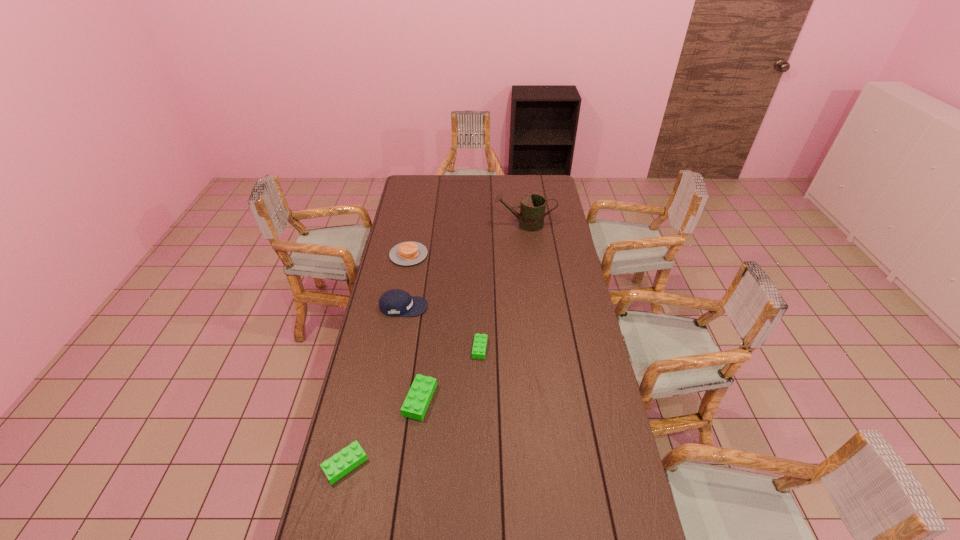
At what (x,y) coordinates should I click in order to perform the action: click on the nearest Lego. Please return your answer as a coordinate pair (x, y). Looking at the image, I should click on (341, 463).

This screenshot has height=540, width=960. Find the location of `the leftmost Lego`. the leftmost Lego is located at coordinates [x=341, y=463].

The height and width of the screenshot is (540, 960). Identify the location of the tallest Lego. (422, 389).

Image resolution: width=960 pixels, height=540 pixels. Identify the location of the second Lego from right to left. (422, 389).

Locate an element on the screen. Image resolution: width=960 pixels, height=540 pixels. the fourth farthest object is located at coordinates (480, 340).

Locate an element on the screen. The image size is (960, 540). the rightmost Lego is located at coordinates (480, 340).

I want to click on the tallest object, so click(532, 206).

Where is `the farthest object`? the farthest object is located at coordinates (532, 206).

You are a GUI agent. You are given a task and a screenshot of the screen. Output one action in this format:
    pyautogui.click(x=<x>, y=<y>)
    Task: Click on the second farthest object
    The width and height of the screenshot is (960, 540).
    Given the screenshot: What is the action you would take?
    pyautogui.click(x=406, y=253)

What are the coordinates of `the fifth shortest object` in the screenshot? It's located at (395, 302).